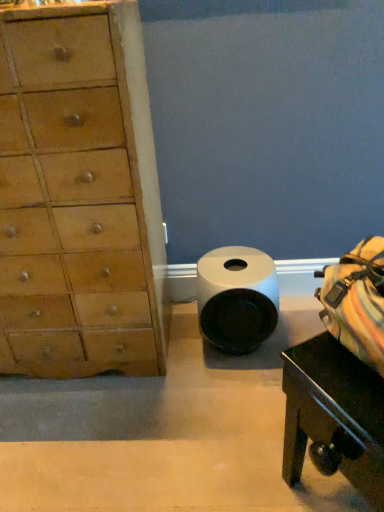
Find the location of a particular element. This screenshot has width=384, height=512. vacant space to the right of light brown wood chest of drawers at left is located at coordinates (209, 388).